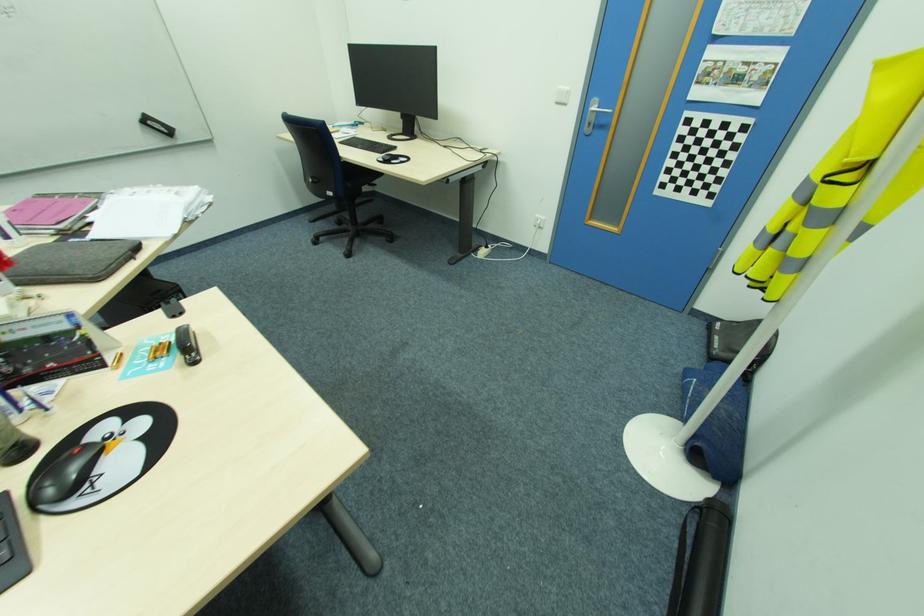
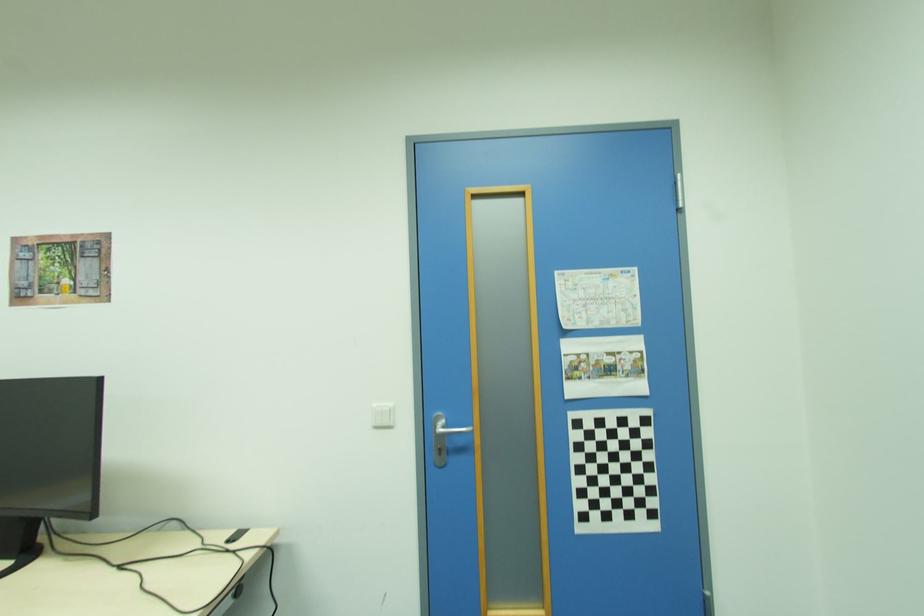
The point at (568, 105) is marked in the first image. Where is the corresponding point in the second image?

(394, 427)